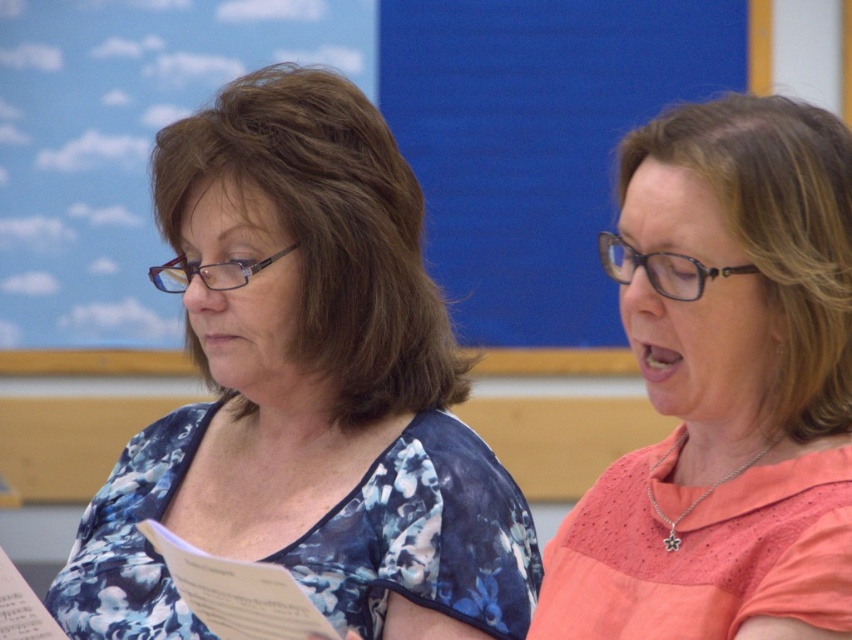
Is point (681, 113) behind point (755, 88)?

No, it is in front of (755, 88).

Locate an element on the screen. pink fabric shirt at upper right is located at coordinates (724, 387).

Between blue floral blouse at center and blue matte bulletin board at upper center, which one appears on the right side from the viewer's perspective?

blue floral blouse at center is more to the right.

Can you confirm if blue floral blouse at center is bigger than blue matte bulletin board at upper center?

Yes, blue floral blouse at center is bigger than blue matte bulletin board at upper center.

At what (x,y) coordinates should I click in order to perform the action: click on blue floral blouse at center. Please return your answer as a coordinate pair (x, y). The width and height of the screenshot is (852, 640). Looking at the image, I should click on (306, 390).

Find the location of a particular element. Image resolution: width=852 pixels, height=640 pixels. blue floral blouse at center is located at coordinates (306, 390).

Can you confirm if blue floral blouse at center is positioned to the left of pink fabric shirt at upper right?

Indeed, blue floral blouse at center is positioned on the left side of pink fabric shirt at upper right.

Locate an element on the screen. The image size is (852, 640). blue floral blouse at center is located at coordinates (306, 390).